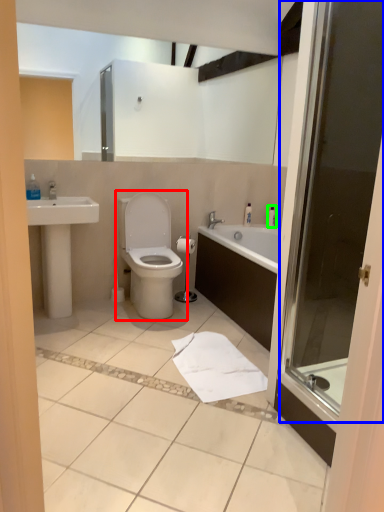
Question: Which object is the closest to the toilet (highlighted by a red box)? Choose among these: screen door (highlighted by a blue box) or toiletry (highlighted by a green box).

Choices:
 (A) screen door
 (B) toiletry

Answer: (B)